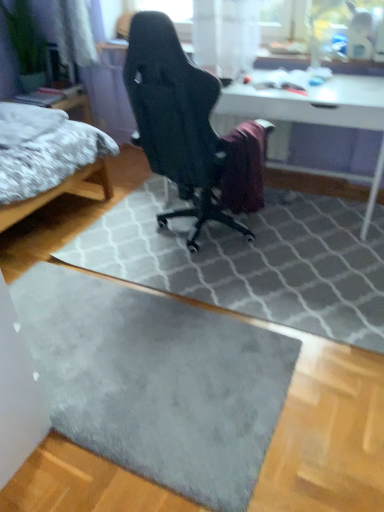
Image resolution: width=384 pixels, height=512 pixels. I want to click on free spot to the right of black mesh chair at center, so click(309, 251).